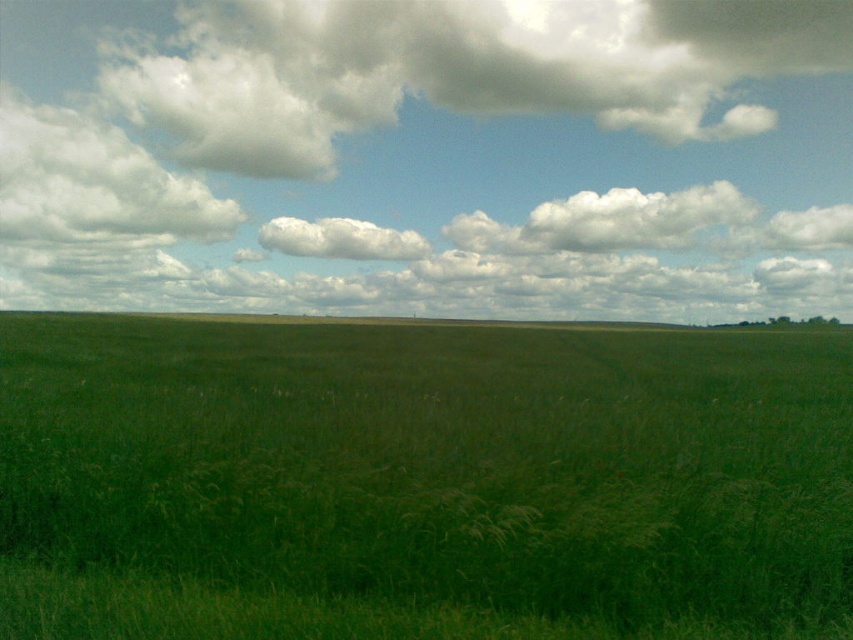
You are standing in the middle of the green grassy pasture at center and looking up at the white fluffy cloud at center. Which object appears bigger to you?

The green grassy pasture at center appears bigger than the white fluffy cloud at center because it has a larger size.

You are standing at the origin point of the image coordinate system. You want to walk to the green grassy pasture at center. In which direction should you move?

The green grassy pasture at center is located at coordinate point (421,481). Since the origin is at the bottom left corner, you should move towards the right and slightly upwards to reach it.

You are an observer looking at the sky. You notice two clouds, the white fluffy cloud at upper left and the white fluffy cloud at center. Which one appears larger in size?

The white fluffy cloud at upper left appears larger in size than the white fluffy cloud at center.